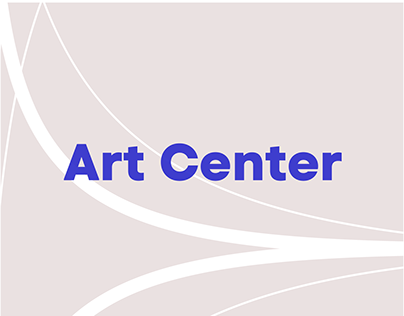
Where is `art`? This screenshot has width=404, height=316. art is located at coordinates (84, 159).